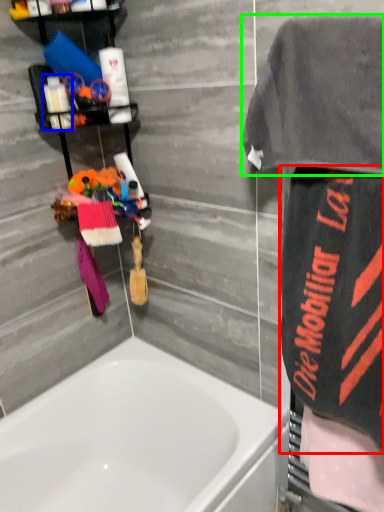
Question: Which object is positioned farthest from beach towel (highlighted by a red box)? Select from toiletry (highlighted by a blue box) and beach towel (highlighted by a green box).

Choices:
 (A) toiletry
 (B) beach towel

Answer: (A)